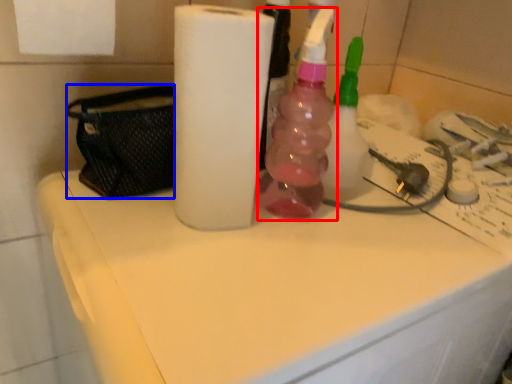
Question: Which object is further to the camera taking this photo, bottle (highlighted by a red box) or pouch (highlighted by a blue box)?

Choices:
 (A) bottle
 (B) pouch

Answer: (A)